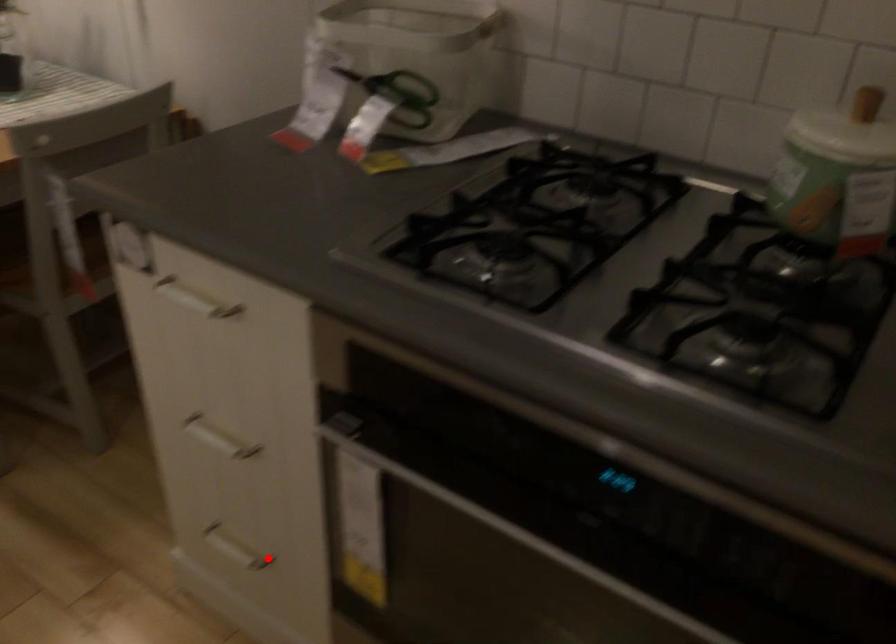
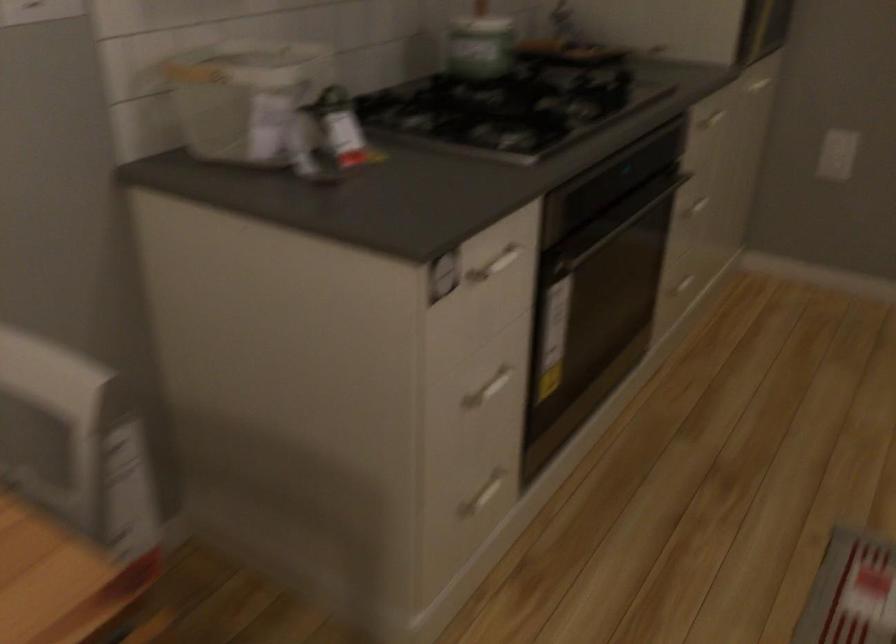
Question: I am providing you with two images of the same scene from different viewpoints. Image1 has a red point marked. In image2, the corresponding 3D location appears at what relative position? Reply with the corresponding letter.

Choices:
 (A) Closer
 (B) Farther

Answer: (B)